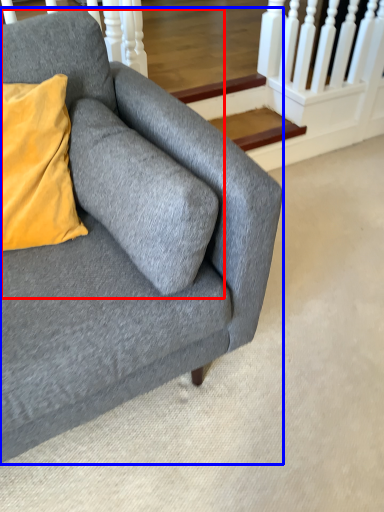
Question: Among these objects, which one is nearest to the camera, swivel chair (highlighted by a red box) or studio couch (highlighted by a blue box)?

Choices:
 (A) swivel chair
 (B) studio couch

Answer: (B)